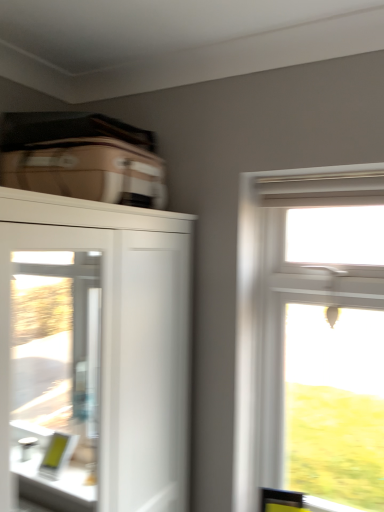
Identify the location of beige fabric suitcase at upper left. (88, 170).

You are a GUI agent. You are given a task and a screenshot of the screen. Output one action in this format:
    pyautogui.click(x=<x>, y=<y>)
    Task: Click on the clear glass window at upper right
    
    Given the screenshot: What is the action you would take?
    pyautogui.click(x=311, y=337)

You are a GUI agent. You are given a task and a screenshot of the screen. Output one action in this format:
    pyautogui.click(x=<x>, y=<y>)
    Task: Click on the beige fabric suitcase at upper left
    The image size is (384, 512).
    Given the screenshot: What is the action you would take?
    pyautogui.click(x=88, y=170)

Where is `window above the white glossy cupboard at upper left (from the image's perspective)`? window above the white glossy cupboard at upper left (from the image's perspective) is located at coordinates (311, 337).

Is clear glass window at upper right thinner than white glossy cupboard at upper left?

Yes, clear glass window at upper right is thinner than white glossy cupboard at upper left.

In terms of height, does clear glass window at upper right look taller or shorter compared to white glossy cupboard at upper left?

Clearly, clear glass window at upper right is taller compared to white glossy cupboard at upper left.

Would you say clear glass window at upper right is a long distance from white glossy cupboard at upper left?

Yes, clear glass window at upper right is far from white glossy cupboard at upper left.

From the picture: From the image's perspective, relative to beige fabric suitcase at upper left, is clear glass window at upper right above or below?

Based on their image positions, clear glass window at upper right is located beneath beige fabric suitcase at upper left.

In the scene shown: From a real-world perspective, does clear glass window at upper right sit lower than beige fabric suitcase at upper left?

Yes, from a real-world perspective, clear glass window at upper right is below beige fabric suitcase at upper left.

Is beige fabric suitcase at upper left located within clear glass window at upper right?

No, beige fabric suitcase at upper left is located outside of clear glass window at upper right.

Between clear glass window at upper right and beige fabric suitcase at upper left, which one has less height?

Standing shorter between the two is beige fabric suitcase at upper left.

Looking at this image, from the image's perspective, relative to clear glass screen door at left, is beige fabric suitcase at upper left above or below?

From the image's perspective, beige fabric suitcase at upper left appears above clear glass screen door at left.

Is clear glass screen door at left inside beige fabric suitcase at upper left?

No, clear glass screen door at left is not surrounded by beige fabric suitcase at upper left.

In the scene shown: Could you tell me if beige fabric suitcase at upper left is turned towards clear glass screen door at left?

No.

Which is in front, point (129, 176) or point (26, 265)?

Point (129, 176)

Find the location of a particular element. The image size is (384, 512). cupboard that is under the clear glass window at upper right (from a real-world perspective) is located at coordinates (94, 354).

Is white glossy cupboard at upper left taller or shorter than clear glass window at upper right?

Considering their sizes, white glossy cupboard at upper left has less height than clear glass window at upper right.

From the picture: Is white glossy cupboard at upper left completely or partially outside of clear glass window at upper right?

white glossy cupboard at upper left lies outside clear glass window at upper right's area.

Between white glossy cupboard at upper left and clear glass window at upper right, which one has larger size?

With larger size is white glossy cupboard at upper left.

Looking at this image, between clear glass window at upper right and clear glass screen door at left, which one has smaller size?

clear glass screen door at left is smaller.

From the image's perspective, does clear glass window at upper right appear lower than clear glass screen door at left?

Yes.

Considering the positions of point (286, 431) and point (80, 346), is point (286, 431) closer or farther from the camera than point (80, 346)?

Point (286, 431).

Is clear glass window at upper right taller or shorter than clear glass screen door at left?

In the image, clear glass window at upper right appears to be taller than clear glass screen door at left.

Considering the positions of objects beige fabric suitcase at upper left and clear glass window at upper right in the image provided, who is more to the right, beige fabric suitcase at upper left or clear glass window at upper right?

Positioned to the right is clear glass window at upper right.

Is beige fabric suitcase at upper left next to clear glass window at upper right and touching it?

No, beige fabric suitcase at upper left is not with clear glass window at upper right.

Who is shorter, beige fabric suitcase at upper left or clear glass window at upper right?

With less height is beige fabric suitcase at upper left.

From a real-world perspective, relative to clear glass window at upper right, is beige fabric suitcase at upper left vertically above or below?

beige fabric suitcase at upper left is situated higher than clear glass window at upper right in the real world.

Which of these two, clear glass screen door at left or clear glass window at upper right, is bigger?

With larger size is clear glass window at upper right.

This screenshot has height=512, width=384. I want to click on screen door in front of the clear glass window at upper right, so click(56, 375).

From a real-world perspective, who is located higher, clear glass screen door at left or clear glass window at upper right?

clear glass screen door at left is physically above.

Is clear glass screen door at left next to clear glass window at upper right and touching it?

They are not placed beside each other.

Where is `window positioned vertically above the white glossy cupboard at upper left (from a real-world perspective)`? Image resolution: width=384 pixels, height=512 pixels. window positioned vertically above the white glossy cupboard at upper left (from a real-world perspective) is located at coordinates (311, 337).

You are a GUI agent. You are given a task and a screenshot of the screen. Output one action in this format:
    pyautogui.click(x=<x>, y=<y>)
    Task: Click on the suitcase that is on the left side of clear glass window at upper right
    This screenshot has width=384, height=512.
    Given the screenshot: What is the action you would take?
    pyautogui.click(x=88, y=170)

Considering their positions, is clear glass screen door at left positioned closer to beige fabric suitcase at upper left than clear glass window at upper right?

clear glass window at upper right is closer to beige fabric suitcase at upper left.

Which object lies nearer to the anchor point clear glass screen door at left, clear glass window at upper right or white glossy cupboard at upper left?

Among the two, white glossy cupboard at upper left is located nearer to clear glass screen door at left.

Estimate the real-world distances between objects in this image. Which object is closer to clear glass window at upper right, beige fabric suitcase at upper left or white glossy cupboard at upper left?

Based on the image, beige fabric suitcase at upper left appears to be nearer to clear glass window at upper right.

Estimate the real-world distances between objects in this image. Which object is further from clear glass window at upper right, white glossy cupboard at upper left or clear glass screen door at left?

white glossy cupboard at upper left is further to clear glass window at upper right.

Based on their spatial positions, is clear glass window at upper right or clear glass screen door at left further from beige fabric suitcase at upper left?

Among the two, clear glass screen door at left is located further to beige fabric suitcase at upper left.

When comparing their distances from white glossy cupboard at upper left, does beige fabric suitcase at upper left or clear glass screen door at left seem closer?

clear glass screen door at left is closer to white glossy cupboard at upper left.

Which object lies further to the anchor point clear glass screen door at left, beige fabric suitcase at upper left or white glossy cupboard at upper left?

Among the two, beige fabric suitcase at upper left is located further to clear glass screen door at left.

When comparing their distances from clear glass screen door at left, does white glossy cupboard at upper left or clear glass window at upper right seem closer?

white glossy cupboard at upper left lies closer to clear glass screen door at left than the other object.

Identify the location of screen door that lies between beige fabric suitcase at upper left and white glossy cupboard at upper left from top to bottom. The image size is (384, 512). coord(56,375).

Locate an element on the screen. screen door between beige fabric suitcase at upper left and clear glass window at upper right in the horizontal direction is located at coordinates (56, 375).

Image resolution: width=384 pixels, height=512 pixels. I want to click on screen door between white glossy cupboard at upper left and clear glass window at upper right, so click(56, 375).

Image resolution: width=384 pixels, height=512 pixels. What are the coordinates of `suitcase situated between white glossy cupboard at upper left and clear glass window at upper right from left to right` in the screenshot? It's located at (88, 170).